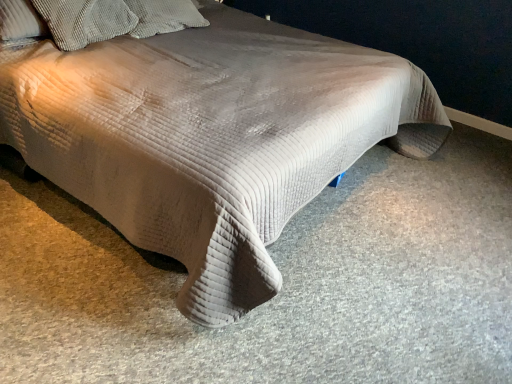
Question: Can textured corduroy pillow at upper left, which ranks as the 2th pillow in left-to-right order, be found inside corduroy pillow at upper left, which is the second pillow in right-to-left order?

Choices:
 (A) yes
 (B) no

Answer: (B)

Question: Would you say corduroy pillow at upper left, which appears as the 1th pillow when viewed from the left, is a long distance from textured corduroy pillow at upper left, which ranks as the 2th pillow in left-to-right order?

Choices:
 (A) no
 (B) yes

Answer: (A)

Question: Is corduroy pillow at upper left, which is the second pillow in right-to-left order, thinner than textured corduroy pillow at upper left, which ranks as the first pillow in right-to-left order?

Choices:
 (A) yes
 (B) no

Answer: (A)

Question: Is corduroy pillow at upper left, which appears as the 1th pillow when viewed from the left, in front of textured corduroy pillow at upper left, which ranks as the 2th pillow in left-to-right order?

Choices:
 (A) no
 (B) yes

Answer: (B)

Question: Considering the relative positions of corduroy pillow at upper left, which appears as the 1th pillow when viewed from the left, and textured corduroy pillow at upper left, which ranks as the 2th pillow in left-to-right order, in the image provided, is corduroy pillow at upper left, which appears as the 1th pillow when viewed from the left, behind textured corduroy pillow at upper left, which ranks as the 2th pillow in left-to-right order,?

Choices:
 (A) no
 (B) yes

Answer: (A)

Question: Is corduroy pillow at upper left, which appears as the 1th pillow when viewed from the left, facing towards textured corduroy pillow at upper left, which ranks as the first pillow in right-to-left order?

Choices:
 (A) no
 (B) yes

Answer: (A)

Question: Is the depth of textured corduroy pillow at upper left, which ranks as the 2th pillow in left-to-right order, greater than that of corduroy pillow at upper left, which appears as the 1th pillow when viewed from the left?

Choices:
 (A) no
 (B) yes

Answer: (B)

Question: Is textured corduroy pillow at upper left, which ranks as the first pillow in right-to-left order, next to corduroy pillow at upper left, which is the second pillow in right-to-left order, and touching it?

Choices:
 (A) yes
 (B) no

Answer: (B)

Question: Considering the relative positions of textured corduroy pillow at upper left, which ranks as the first pillow in right-to-left order, and corduroy pillow at upper left, which is the second pillow in right-to-left order, in the image provided, is textured corduroy pillow at upper left, which ranks as the first pillow in right-to-left order, to the right of corduroy pillow at upper left, which is the second pillow in right-to-left order, from the viewer's perspective?

Choices:
 (A) no
 (B) yes

Answer: (B)

Question: Is textured corduroy pillow at upper left, which ranks as the 2th pillow in left-to-right order, outside corduroy pillow at upper left, which is the second pillow in right-to-left order?

Choices:
 (A) yes
 (B) no

Answer: (A)

Question: Is corduroy pillow at upper left, which is the second pillow in right-to-left order, completely or partially inside textured corduroy pillow at upper left, which ranks as the 2th pillow in left-to-right order?

Choices:
 (A) yes
 (B) no

Answer: (B)

Question: From the image's perspective, is textured corduroy pillow at upper left, which ranks as the first pillow in right-to-left order, beneath corduroy pillow at upper left, which is the second pillow in right-to-left order?

Choices:
 (A) no
 (B) yes

Answer: (A)

Question: Looking at their shapes, would you say textured corduroy pillow at upper left, which ranks as the first pillow in right-to-left order, is wider or thinner than corduroy pillow at upper left, which appears as the 1th pillow when viewed from the left?

Choices:
 (A) wide
 (B) thin

Answer: (A)